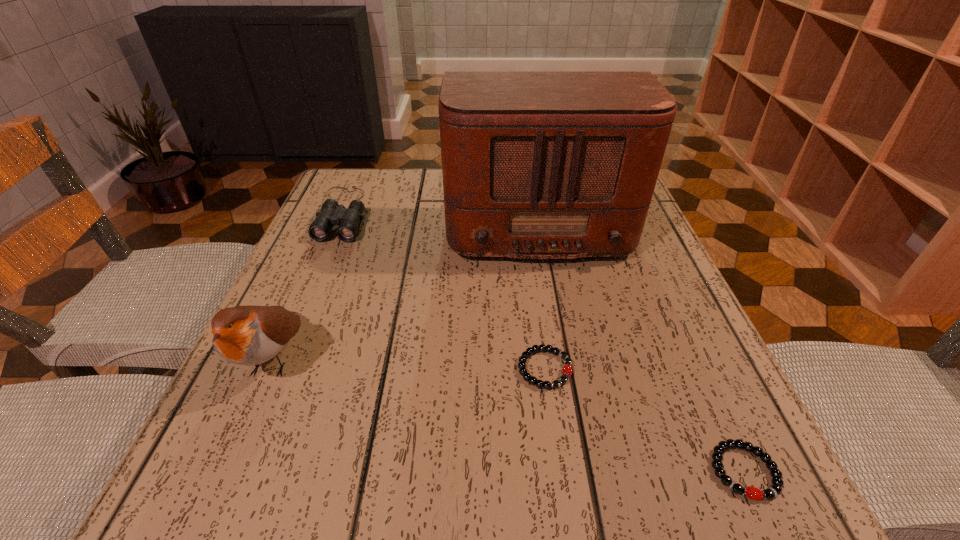
I want to click on unoccupied position between the right bracelet and the tallest object, so click(640, 346).

Identify the location of free area in between the nearest object and the third shortest object. This screenshot has height=540, width=960. (543, 342).

Find the location of `free point between the nearer bracelet and the third tallest object`. free point between the nearer bracelet and the third tallest object is located at coordinates (543, 342).

Locate an element on the screen. The height and width of the screenshot is (540, 960). free point between the bird and the farther bracelet is located at coordinates (409, 364).

Image resolution: width=960 pixels, height=540 pixels. Find the location of `vacant area between the third shortest object and the right bracelet`. vacant area between the third shortest object and the right bracelet is located at coordinates (543, 342).

Where is `free spot between the radio receiver and the bird`? This screenshot has width=960, height=540. free spot between the radio receiver and the bird is located at coordinates (405, 290).

Find the location of a particular element. Image resolution: width=960 pixels, height=540 pixels. object that stands as the closest to the left bracelet is located at coordinates (774, 490).

Image resolution: width=960 pixels, height=540 pixels. Find the location of `object that is the nearest to the nearer bracelet`. object that is the nearest to the nearer bracelet is located at coordinates (567, 370).

This screenshot has width=960, height=540. What are the coordinates of `vacant position in the image that satisfies the following two spatial constraints: 1. at the face of the bird; 2. on the right side of the left bracelet` in the screenshot? It's located at (269, 369).

This screenshot has width=960, height=540. I want to click on free spot that satisfies the following two spatial constraints: 1. at the eyepiece of the farther bracelet; 2. on the left side of the binoculars, so click(277, 369).